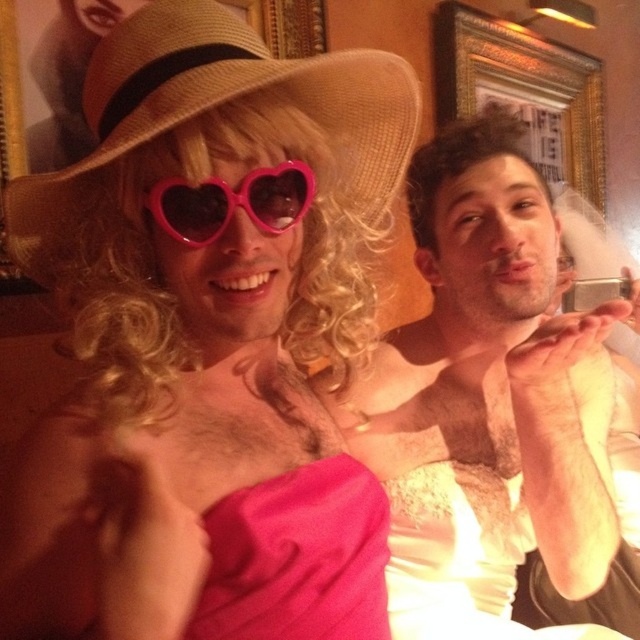
Who is positioned more to the right, straw hat at left or pink heart-shaped sunglasses at center?

From the viewer's perspective, pink heart-shaped sunglasses at center appears more on the right side.

Can you confirm if straw hat at left is thinner than pink heart-shaped sunglasses at center?

No.

In the scene shown: Who is more forward, [148,54] or [221,200]?

Point [148,54]

What are the coordinates of `straw hat at left` in the screenshot? It's located at (218, 106).

Which of these two, pink matte heart-shaped sunglasses at upper left or straw hat at left, stands taller?

pink matte heart-shaped sunglasses at upper left

Who is higher up, pink matte heart-shaped sunglasses at upper left or straw hat at left?

Positioned higher is straw hat at left.

Where is `pink matte heart-shaped sunglasses at upper left`? The image size is (640, 640). pink matte heart-shaped sunglasses at upper left is located at coordinates (208, 340).

Is matte white dress at center smaller than pink heart-shaped sunglasses at center?

Actually, matte white dress at center might be larger than pink heart-shaped sunglasses at center.

Which is in front, point (429, 568) or point (209, 236)?

Point (209, 236) is more forward.

Locate an element on the screen. The width and height of the screenshot is (640, 640). matte white dress at center is located at coordinates (486, 400).